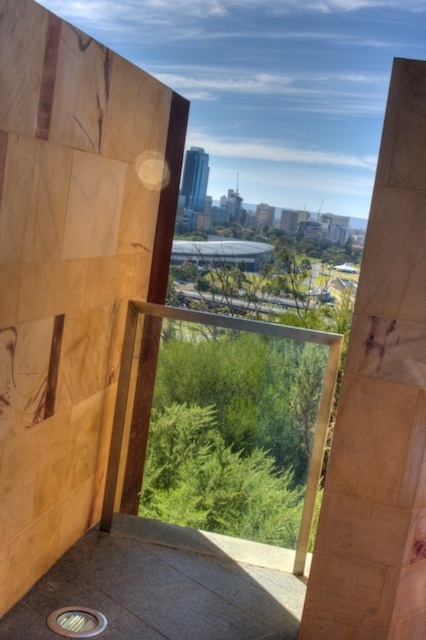
Is point (371, 195) in front of point (97, 611)?

Yes.

Which of these two, wooden at right or metallic circular drain at lower left, stands taller?

wooden at right

Where is `wooden at right`? The width and height of the screenshot is (426, 640). wooden at right is located at coordinates (380, 406).

Can you confirm if marble-like stone pillar at center is positioned to the right of metallic circular drain at lower left?

Correct, you'll find marble-like stone pillar at center to the right of metallic circular drain at lower left.

Between point (147, 369) and point (80, 636), which one is positioned in front?

Positioned in front is point (80, 636).

Where is `marble-like stone pillar at center`? This screenshot has width=426, height=640. marble-like stone pillar at center is located at coordinates (71, 268).

What do you see at coordinates (71, 268) in the screenshot? The width and height of the screenshot is (426, 640). I see `marble-like stone pillar at center` at bounding box center [71, 268].

Is marble-like stone pillar at center to the left of wooden at right from the viewer's perspective?

Indeed, marble-like stone pillar at center is positioned on the left side of wooden at right.

Measure the distance between point (109,216) and camera.

Point (109,216) is 3.19 meters from camera.

At what (x,y) coordinates should I click in order to perform the action: click on marble-like stone pillar at center. Please return your answer as a coordinate pair (x, y). The height and width of the screenshot is (640, 426). Looking at the image, I should click on (71, 268).